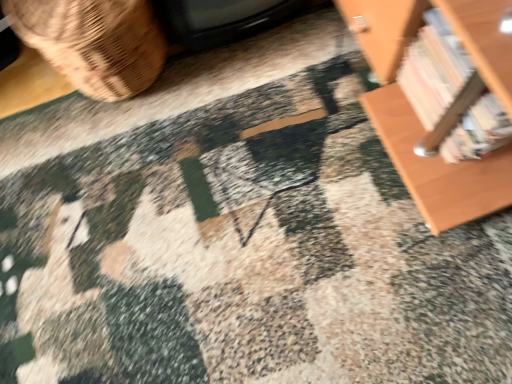
Question: In the image, is brown woven basket at left positioned in front of or behind wooden bookshelf at upper right?

Choices:
 (A) behind
 (B) front

Answer: (A)

Question: In the image, is brown woven basket at left on the left side or the right side of wooden bookshelf at upper right?

Choices:
 (A) right
 (B) left

Answer: (B)

Question: Which is correct: brown woven basket at left is inside wooden bookshelf at upper right, or outside of it?

Choices:
 (A) outside
 (B) inside

Answer: (A)

Question: Is wooden bookshelf at upper right inside or outside of brown woven basket at left?

Choices:
 (A) inside
 (B) outside

Answer: (B)

Question: In terms of width, does wooden bookshelf at upper right look wider or thinner when compared to brown woven basket at left?

Choices:
 (A) thin
 (B) wide

Answer: (A)

Question: Is point (441, 142) closer or farther from the camera than point (123, 49)?

Choices:
 (A) farther
 (B) closer

Answer: (B)

Question: From the image's perspective, is wooden bookshelf at upper right located above or below brown woven basket at left?

Choices:
 (A) above
 (B) below

Answer: (B)